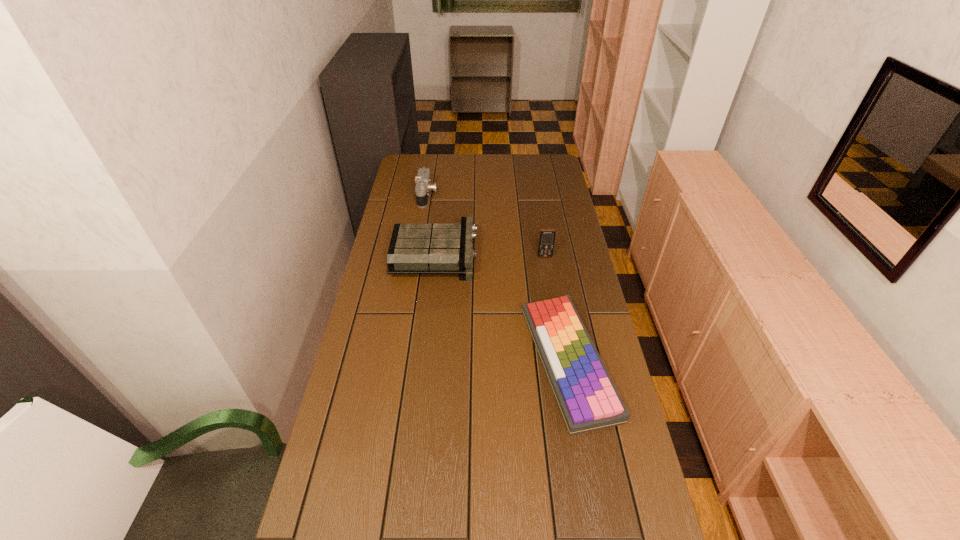
Find the location of `free spot between the computer keyboard and the radio receiver`. free spot between the computer keyboard and the radio receiver is located at coordinates (502, 308).

Locate an element on the screen. The image size is (960, 540). free space between the nearest object and the radio receiver is located at coordinates (502, 308).

Identify the location of vacant space in between the cellular telephone and the camera. The image size is (960, 540). (486, 226).

What are the coordinates of `object that is the closest to the tallest object` in the screenshot? It's located at (414, 248).

Locate which object ranks second in proximity to the radio receiver. Please provide its 2D coordinates. Your answer should be formatted as a tuple, i.e. [(x, y)], where the tuple contains the x and y coordinates of a point satisfying the conditions above.

[(588, 400)]

Locate an element on the screen. vacant position in the image that satisfies the following two spatial constraints: 1. on the lens of the nearest object; 2. on the left side of the farthest object is located at coordinates (399, 361).

This screenshot has height=540, width=960. Find the location of `free space that satisfies the following two spatial constraints: 1. on the screen of the nearest object; 2. on the right side of the cellular telephone`. free space that satisfies the following two spatial constraints: 1. on the screen of the nearest object; 2. on the right side of the cellular telephone is located at coordinates (563, 361).

Identify the location of free point that satisfies the following two spatial constraints: 1. on the lens of the computer keyboard; 2. on the left side of the camera. The width and height of the screenshot is (960, 540). (399, 361).

The image size is (960, 540). In order to click on free location that satisfies the following two spatial constraints: 1. on the front panel of the nearest object; 2. on the right side of the radio receiver in this screenshot , I will do `click(423, 361)`.